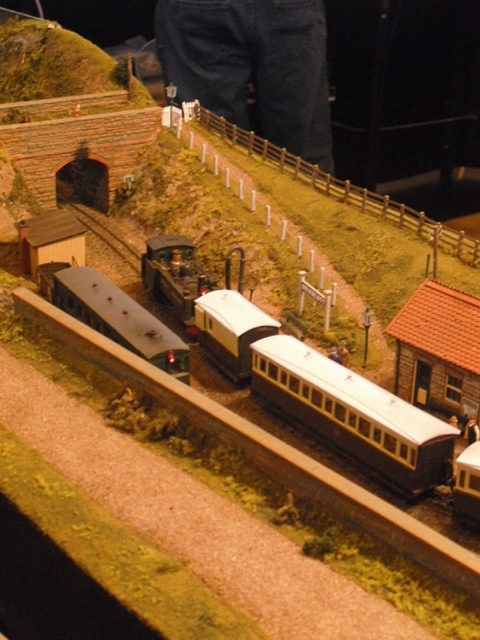
Identify the location of matte black train car at center. (352, 413).

Between matte black train car at center and matte silver train car at center, which one has less height?

Standing shorter between the two is matte black train car at center.

What do you see at coordinates (352, 413) in the screenshot? I see `matte black train car at center` at bounding box center [352, 413].

Locate an element on the screen. The image size is (480, 640). matte black train car at center is located at coordinates (352, 413).